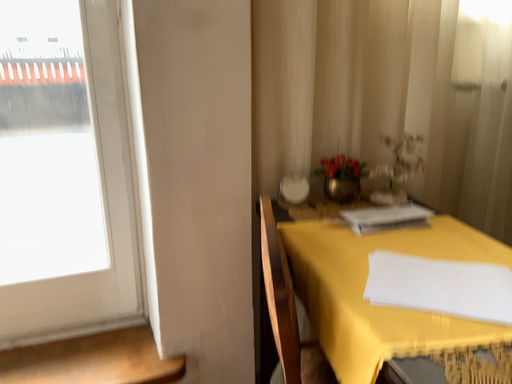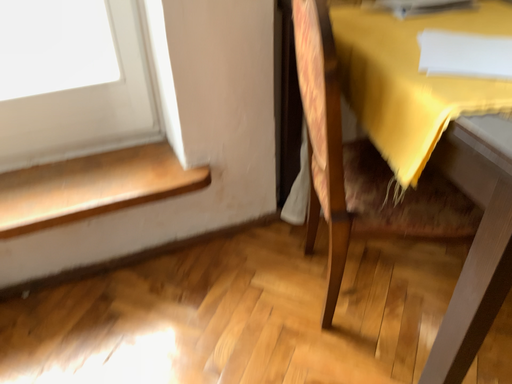
Question: How did the camera likely rotate when shooting the video?

Choices:
 (A) rotated upward
 (B) rotated downward

Answer: (B)